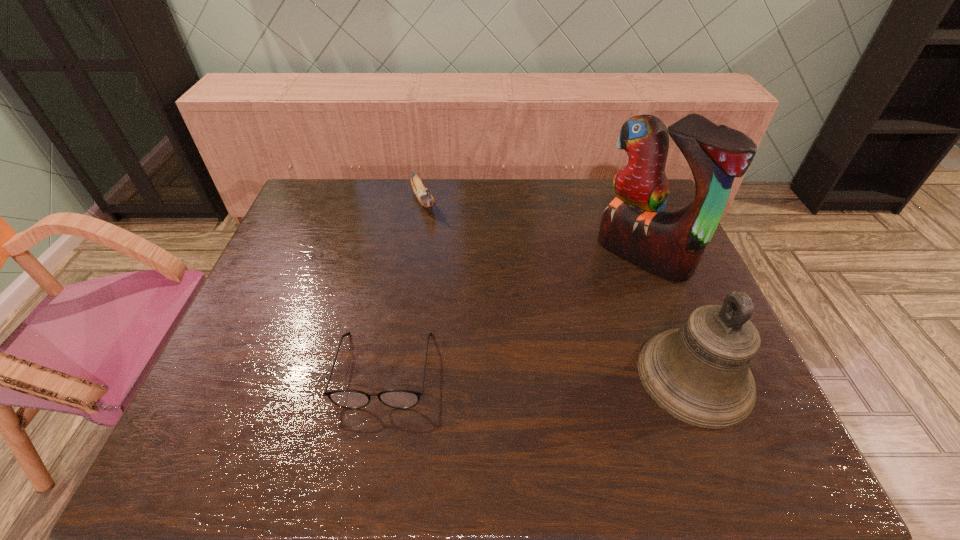
The image size is (960, 540). Find the location of `blank space located 0.120m at the face of the third nearest object`. blank space located 0.120m at the face of the third nearest object is located at coordinates (593, 298).

Locate an element on the screen. This screenshot has width=960, height=540. vacant space situated at the face of the third nearest object is located at coordinates (591, 299).

This screenshot has height=540, width=960. What are the coordinates of `free space located at the face of the third nearest object` in the screenshot? It's located at (582, 307).

The width and height of the screenshot is (960, 540). I want to click on object situated at the far edge, so pyautogui.click(x=425, y=199).

The image size is (960, 540). In order to click on spectacles that is at the near edge in this screenshot , I will do `click(352, 399)`.

Find the location of a particular element. bell present at the near edge is located at coordinates pos(699,373).

Where is `bell that is positioned at the right edge`? bell that is positioned at the right edge is located at coordinates (699, 373).

Locate an element on the screen. The image size is (960, 540). parrot that is at the right edge is located at coordinates (635, 226).

The image size is (960, 540). Find the location of `object that is positioned at the near right corner`. object that is positioned at the near right corner is located at coordinates (699, 373).

Identify the location of vacant space at the far edge of the desktop. (460, 215).